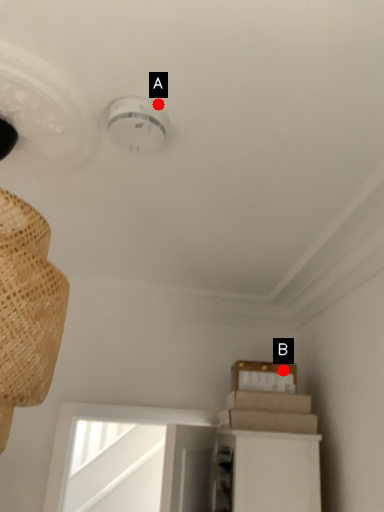
Question: Two points are circled on the image, labeled by A and B beside each circle. Which point is closer to the camera taking this photo?

Choices:
 (A) A is closer
 (B) B is closer

Answer: (A)